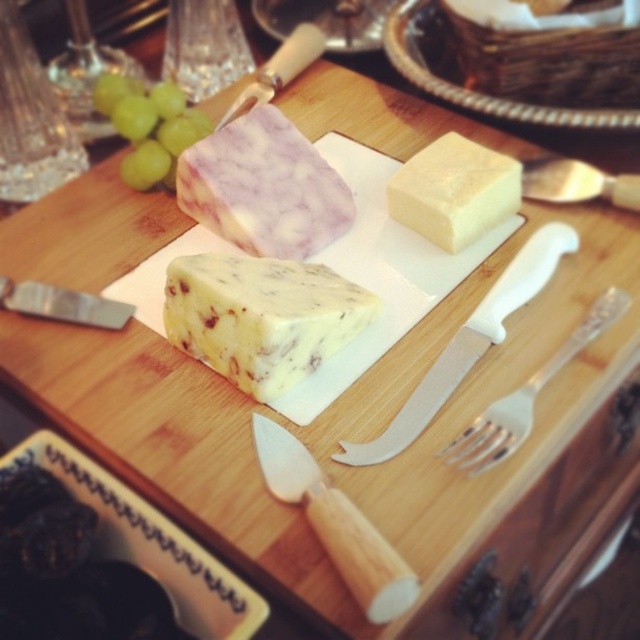
Is point (492, 97) closer to viewer compared to point (524, 168)?

No, it is not.

Between matte wicker basket at upper center and silvermetallicspoon at right, which one has more height?

matte wicker basket at upper center is taller.

Between point (403, 26) and point (560, 182), which one is positioned behind?

The point (403, 26) is more distant.

Locate an element on the screen. This screenshot has width=640, height=640. matte wicker basket at upper center is located at coordinates (464, 74).

Is black matte platter at lower left behind green shiny grapes at upper left?

No.

Is the position of black matte platter at lower left less distant than that of green shiny grapes at upper left?

Yes, black matte platter at lower left is in front of green shiny grapes at upper left.

Find the location of a particular element. The height and width of the screenshot is (640, 640). black matte platter at lower left is located at coordinates (154, 544).

From the picture: Can you confirm if black matte platter at lower left is thinner than white plastic knife at center?

Indeed, black matte platter at lower left has a lesser width compared to white plastic knife at center.

Does black matte platter at lower left have a greater width compared to white plastic knife at center?

Incorrect, black matte platter at lower left's width does not surpass white plastic knife at center's.

Who is more distant from viewer, (145, 544) or (520, 268)?

The point (520, 268) is behind.

This screenshot has width=640, height=640. Identify the location of black matte platter at lower left. (154, 544).